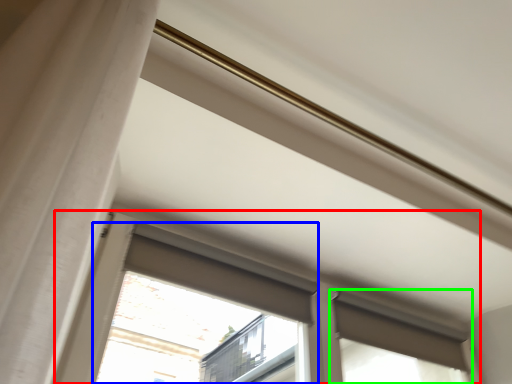
Question: Considering the real-world distances, which object is farthest from window (highlighted by a red box)? bay window (highlighted by a blue box) or window (highlighted by a green box)?

Choices:
 (A) bay window
 (B) window

Answer: (A)